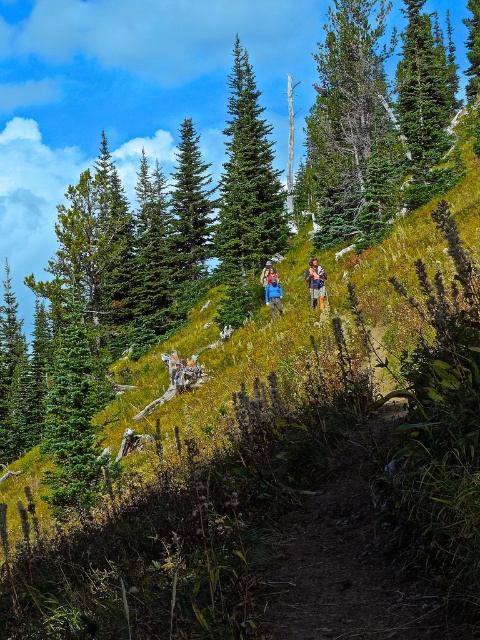
Can you confirm if green textured tree at upper center is positioned above green textured pine tree at center?

Indeed, green textured tree at upper center is positioned over green textured pine tree at center.

From the picture: Does green textured tree at upper center have a lesser width compared to green textured pine tree at center?

No.

This screenshot has width=480, height=640. What do you see at coordinates (350, 129) in the screenshot?
I see `green textured tree at upper center` at bounding box center [350, 129].

What are the coordinates of `green textured tree at upper center` in the screenshot? It's located at (350, 129).

Is green textured tree at upper center shorter than blue fabric jacket at center?

In fact, green textured tree at upper center may be taller than blue fabric jacket at center.

The height and width of the screenshot is (640, 480). What are the coordinates of `green textured tree at upper center` in the screenshot? It's located at (350, 129).

I want to click on green textured tree at upper center, so click(350, 129).

Who is positioned more to the right, camouflage fabric backpack at center or blue fabric jacket at center?

camouflage fabric backpack at center is more to the right.

Between camouflage fabric backpack at center and blue fabric jacket at center, which one has more height?

blue fabric jacket at center

Is point (320, 289) in front of point (278, 296)?

Yes, point (320, 289) is in front of point (278, 296).

Locate an element on the screen. This screenshot has height=640, width=480. camouflage fabric backpack at center is located at coordinates (315, 282).